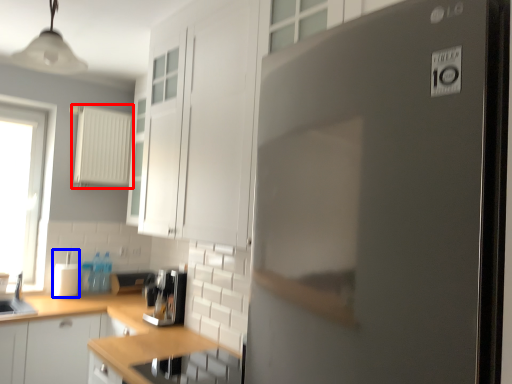
Question: Which point is closer to the camera, appliance (highlighted by a red box) or appliance (highlighted by a blue box)?

Choices:
 (A) appliance
 (B) appliance

Answer: (B)